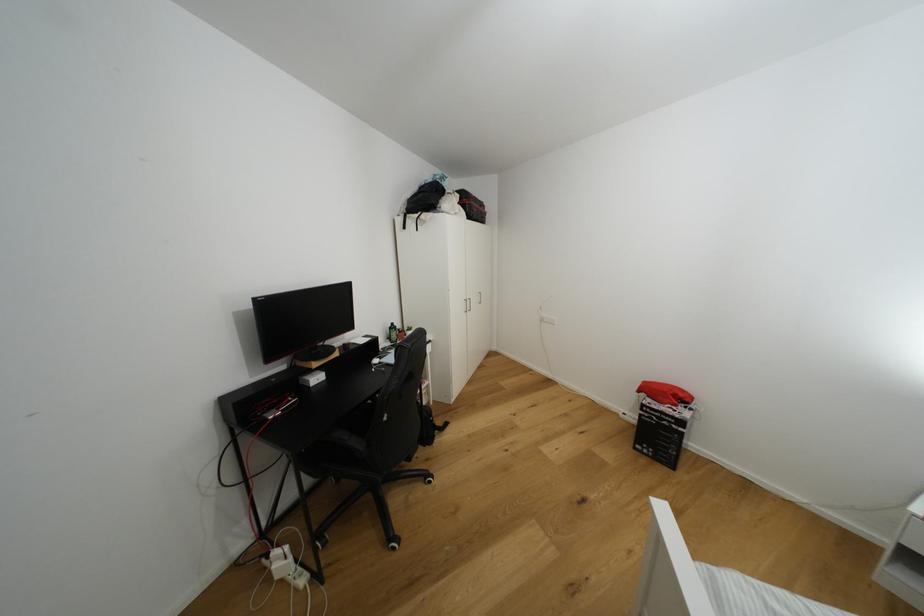
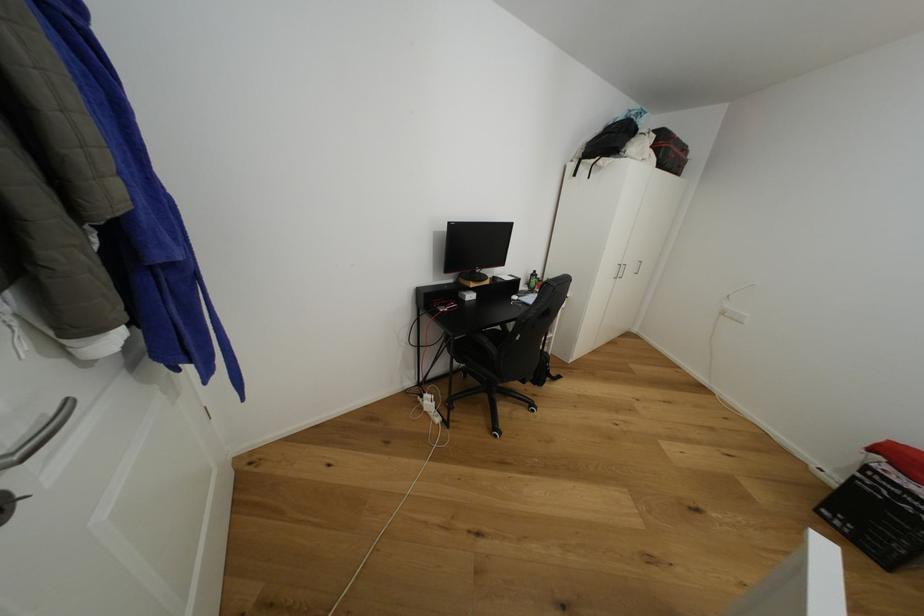
The point at (463, 193) is marked in the first image. Where is the corresponding point in the second image?

(660, 132)